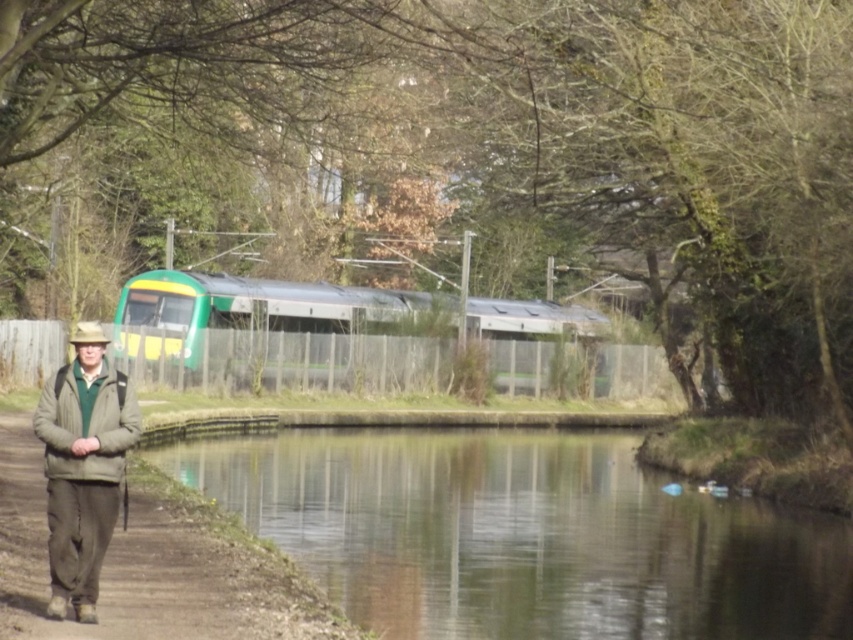
Question: Can you confirm if green glassy water at center is positioned to the right of khaki fabric jacket at lower left?

Choices:
 (A) yes
 (B) no

Answer: (A)

Question: Considering the real-world distances, which object is closest to the dull brown dirt path at lower left?

Choices:
 (A) khaki fabric jacket at lower left
 (B) green glassy water at center

Answer: (A)

Question: Which of the following is the closest to the observer?

Choices:
 (A) (241, 586)
 (B) (381, 456)
 (C) (62, 390)

Answer: (C)

Question: Which object is positioned closest to the khaki fabric jacket at lower left?

Choices:
 (A) green glassy water at center
 (B) dull brown dirt path at lower left

Answer: (B)

Question: Is green glassy water at center smaller than khaki fabric jacket at lower left?

Choices:
 (A) yes
 (B) no

Answer: (B)

Question: Does green glassy water at center appear over dull brown dirt path at lower left?

Choices:
 (A) no
 (B) yes

Answer: (A)